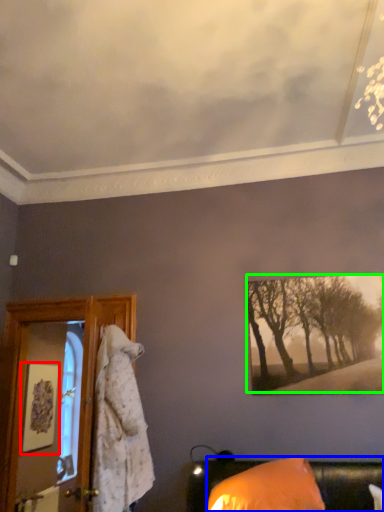
Question: Which object is the farthest from picture frame (highlighted by a red box)? Choose among these: furniture (highlighted by a blue box) or tree (highlighted by a green box).

Choices:
 (A) furniture
 (B) tree

Answer: (A)